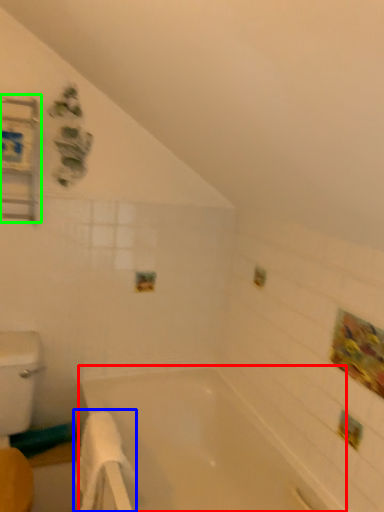
Question: Based on their relative distances, which object is farther from bathtub (highlighted by a red box)? Choose from bath towel (highlighted by a blue box) and medicine cabinet (highlighted by a green box).

Choices:
 (A) bath towel
 (B) medicine cabinet

Answer: (B)